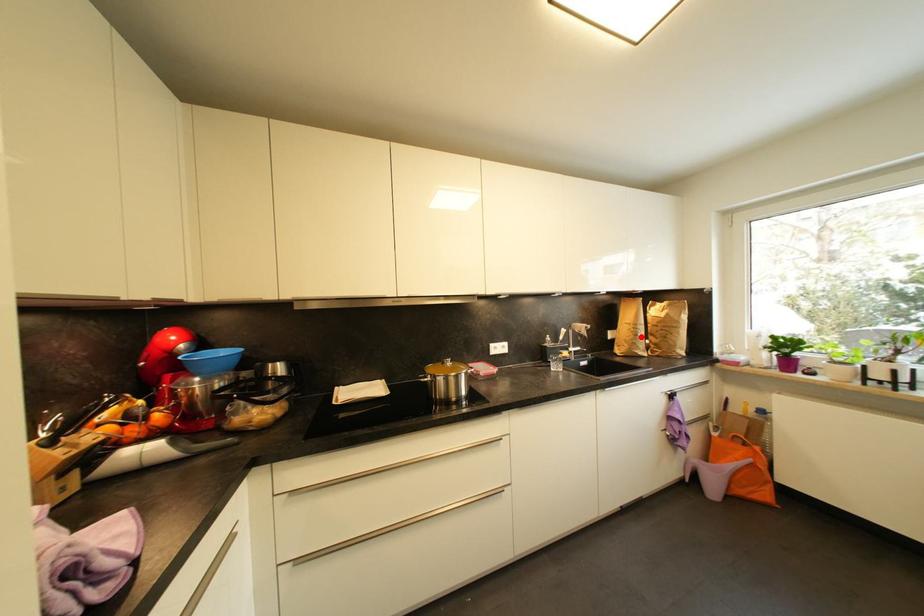
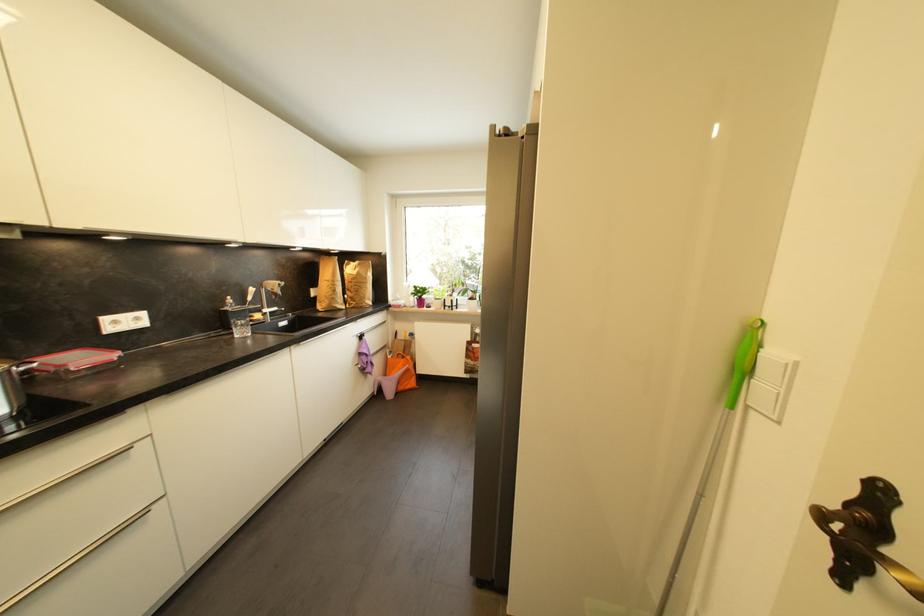
Locate, in the second image, the point that corresponds to the highlighted location in the first image.

(339, 293)